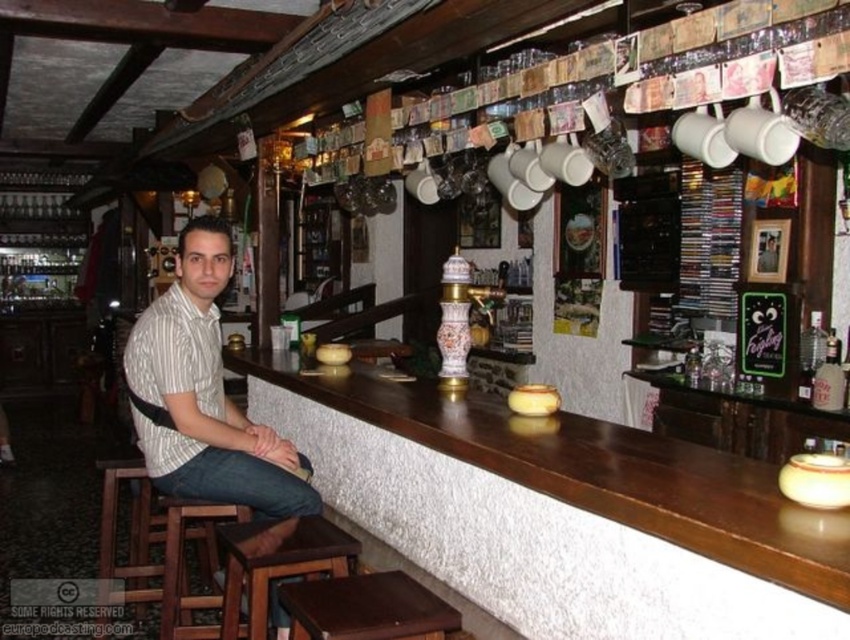
Question: Which object appears farthest from the camera in this image?

Choices:
 (A) white striped shirt at center
 (B) dark brown wood bar stool at lower center

Answer: (A)

Question: Does brown wooden bar stool at lower left have a lesser width compared to brown wooden stool at lower left?

Choices:
 (A) yes
 (B) no

Answer: (A)

Question: Which object is positioned closest to the white striped shirt at center?

Choices:
 (A) brown wooden bar stool at lower left
 (B) dark brown wood bar stool at lower center

Answer: (A)

Question: Which point is closer to the camera?

Choices:
 (A) (384, 596)
 (B) (323, 531)
 (C) (162, 586)

Answer: (A)

Question: Can you confirm if white striped shirt at center is thinner than brown wooden stool at lower left?

Choices:
 (A) no
 (B) yes

Answer: (A)

Question: Does dark brown wood bar stool at lower center have a smaller size compared to brown wooden stool at lower left?

Choices:
 (A) yes
 (B) no

Answer: (A)